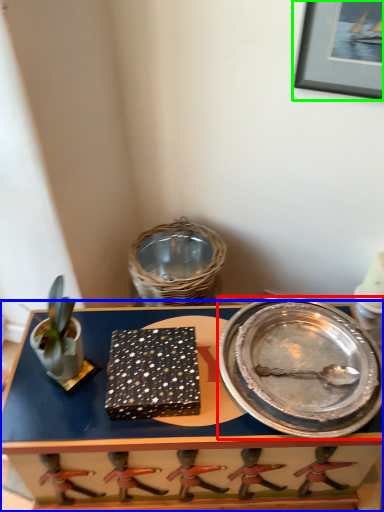
Question: Estimate the real-world distances between objects in this image. Which object is closer to platter (highlighted by a red box), table (highlighted by a blue box) or picture frame (highlighted by a green box)?

Choices:
 (A) table
 (B) picture frame

Answer: (A)